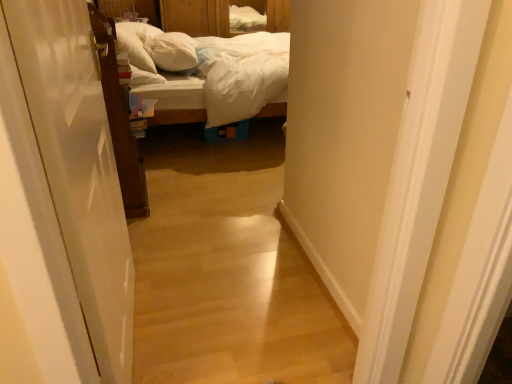
Question: Is white soft pillow at upper left, placed as the second pillow when sorted from right to left, bigger than wooden bed at center?

Choices:
 (A) yes
 (B) no

Answer: (B)

Question: Is white soft pillow at upper left, the first pillow viewed from the left, at the right side of wooden bed at center?

Choices:
 (A) no
 (B) yes

Answer: (A)

Question: Is wooden bed at center surrounded by white soft pillow at upper left, placed as the second pillow when sorted from right to left?

Choices:
 (A) yes
 (B) no

Answer: (B)

Question: Is white soft pillow at upper left, the first pillow viewed from the left, not inside wooden bed at center?

Choices:
 (A) no
 (B) yes

Answer: (A)

Question: From the image's perspective, is white soft pillow at upper left, placed as the second pillow when sorted from right to left, beneath wooden bed at center?

Choices:
 (A) yes
 (B) no

Answer: (B)

Question: Choose the correct answer: Is brown wooden door at left, the 2th door in the front-to-back sequence, inside wooden bed at center or outside it?

Choices:
 (A) inside
 (B) outside

Answer: (B)

Question: Would you say brown wooden door at left, which ranks as the 1th door in left-to-right order, is to the left or to the right of wooden bed at center in the picture?

Choices:
 (A) left
 (B) right

Answer: (A)

Question: In the image, is brown wooden door at left, the second door from the right, positioned in front of or behind wooden bed at center?

Choices:
 (A) behind
 (B) front

Answer: (B)

Question: Is point (147, 210) positioned closer to the camera than point (192, 104)?

Choices:
 (A) closer
 (B) farther

Answer: (A)

Question: Considering the positions of point (111, 304) and point (116, 23), is point (111, 304) closer or farther from the camera than point (116, 23)?

Choices:
 (A) closer
 (B) farther

Answer: (A)

Question: From the image's perspective, is white glossy door at left, which ranks as the second door in left-to-right order, above or below white soft pillow at upper left, placed as the second pillow when sorted from right to left?

Choices:
 (A) above
 (B) below

Answer: (B)

Question: From a real-world perspective, is white glossy door at left, which is the 1th door from right to left, above or below white soft pillow at upper left, placed as the second pillow when sorted from right to left?

Choices:
 (A) above
 (B) below

Answer: (B)

Question: Considering the positions of white glossy door at left, which is the 1th door from right to left, and white soft pillow at upper left, placed as the second pillow when sorted from right to left, in the image, is white glossy door at left, which is the 1th door from right to left, wider or thinner than white soft pillow at upper left, placed as the second pillow when sorted from right to left,?

Choices:
 (A) wide
 (B) thin

Answer: (B)

Question: From the image's perspective, is white soft pillow at center, which is counted as the second pillow, starting from the left, located above or below white glossy door at left, which is counted as the 2th door, starting from the back?

Choices:
 (A) above
 (B) below

Answer: (A)

Question: In terms of size, does white soft pillow at center, placed as the first pillow when sorted from right to left, appear bigger or smaller than white glossy door at left, which is counted as the 2th door, starting from the back?

Choices:
 (A) big
 (B) small

Answer: (B)